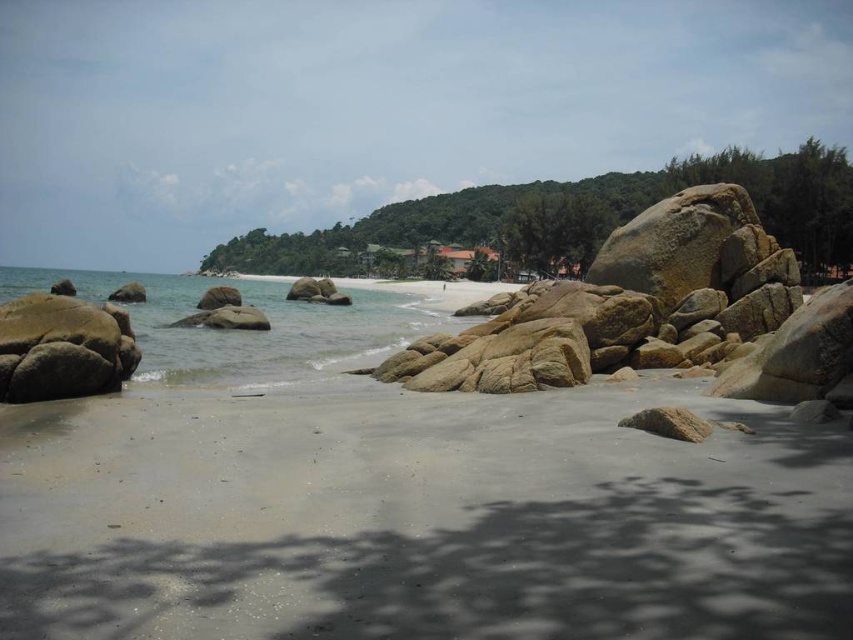
Question: Which is farther from the smooth sand at lower left?

Choices:
 (A) gray sand at lower center
 (B) smooth brown rock at lower left
 (C) smooth granite rocks at center

Answer: (A)

Question: Can you confirm if gray sand at lower center is thinner than smooth granite rocks at center?

Choices:
 (A) yes
 (B) no

Answer: (A)

Question: Which object appears closest to the camera in this image?

Choices:
 (A) smooth sand at lower left
 (B) smooth granite rocks at center

Answer: (B)

Question: Which of these objects is positioned farthest from the smooth granite rocks at center?

Choices:
 (A) smooth brown rock at lower left
 (B) smooth sand at lower left
 (C) gray sand at lower center

Answer: (B)

Question: Is smooth granite rocks at center to the left of smooth brown rock at lower left from the viewer's perspective?

Choices:
 (A) no
 (B) yes

Answer: (A)

Question: Does gray sand at lower center have a greater width compared to smooth sand at lower left?

Choices:
 (A) yes
 (B) no

Answer: (B)